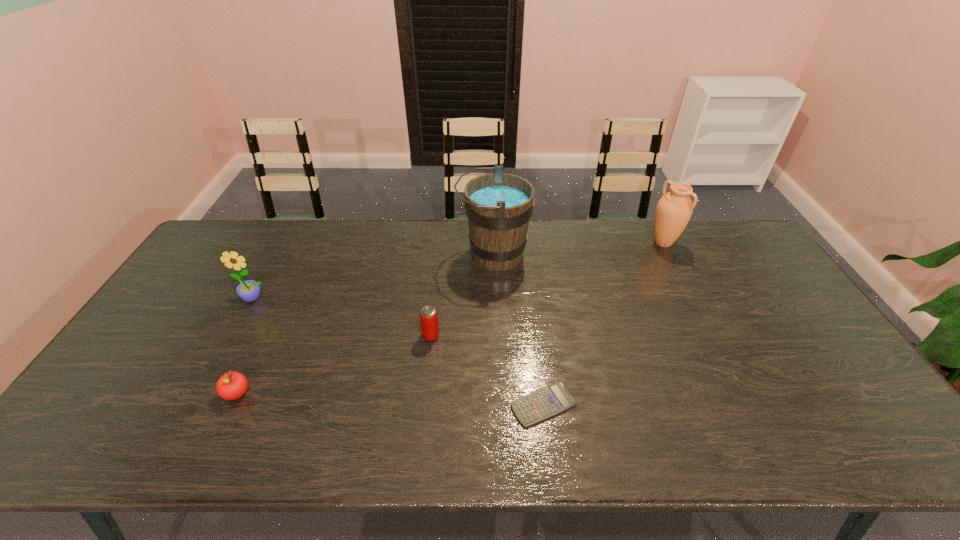
Find the location of a particular element. The image size is (960, 540). object at the near edge is located at coordinates (555, 398).

Locate an element on the screen. free space at the far edge of the desktop is located at coordinates (391, 255).

Find the location of a particular element. The image size is (960, 540). free space at the near edge is located at coordinates (267, 455).

The width and height of the screenshot is (960, 540). I want to click on vacant space at the left edge, so click(x=172, y=319).

I want to click on vacant space at the right edge of the desktop, so click(787, 320).

Locate an element on the screen. Image resolution: width=960 pixels, height=540 pixels. free spot at the far left corner of the desktop is located at coordinates (246, 232).

This screenshot has width=960, height=540. What are the coordinates of `free spot between the third nearest object and the fourth shortest object` in the screenshot? It's located at (343, 316).

Image resolution: width=960 pixels, height=540 pixels. I want to click on vacant space in between the fifth object from right to left and the beer can, so click(x=334, y=364).

I want to click on vacant space in between the tallest object and the rightmost object, so click(578, 248).

The image size is (960, 540). Find the location of `vacant region between the wine bucket and the calculator`. vacant region between the wine bucket and the calculator is located at coordinates (518, 329).